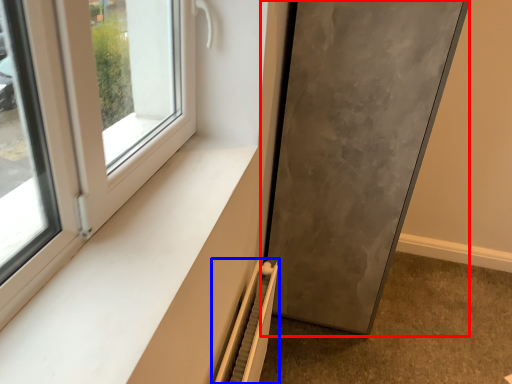
Question: Which point is closer to the camera, door (highlighted by a red box) or radiator (highlighted by a blue box)?

Choices:
 (A) door
 (B) radiator

Answer: (B)